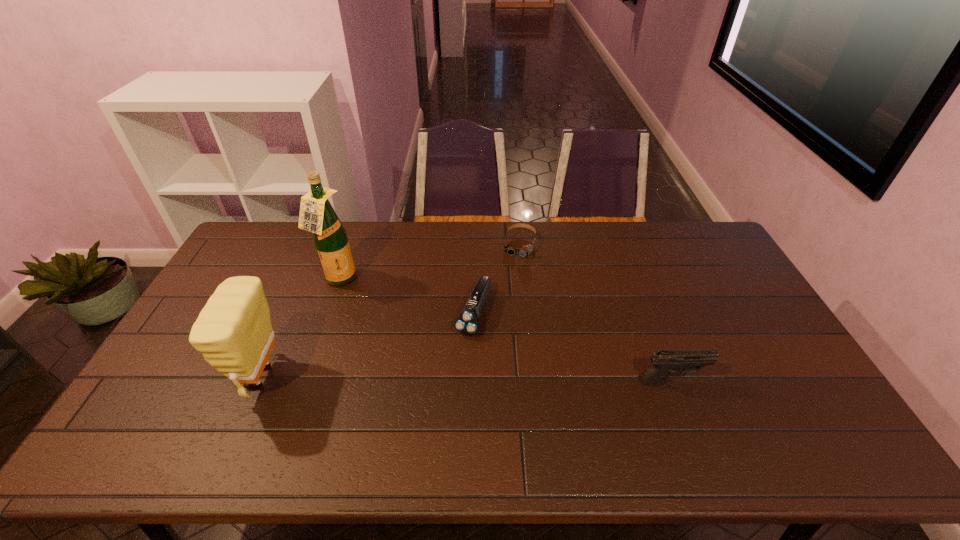
Find the location of a particular element. The height and width of the screenshot is (540, 960). vacant space situated 0.130m on the face of the sponge is located at coordinates [191, 377].

Image resolution: width=960 pixels, height=540 pixels. I want to click on free location located 0.280m at the barrel of the third shortest object, so click(x=806, y=381).

The height and width of the screenshot is (540, 960). What are the coordinates of `free space located 0.260m on the front-facing side of the liquor` in the screenshot? It's located at (399, 330).

Locate an element on the screen. The image size is (960, 540). vacant space located on the front-facing side of the liquor is located at coordinates (361, 300).

Identify the location of free location located on the front-facing side of the liquor. This screenshot has height=540, width=960. (365, 302).

You are a GUI agent. You are given a task and a screenshot of the screen. Output one action in this format:
    pyautogui.click(x=<x>, y=<y>)
    Task: Click on the free space located on the front-facing side of the second object from right to left
    The height and width of the screenshot is (540, 960).
    Given the screenshot: What is the action you would take?
    pyautogui.click(x=512, y=280)

What are the coordinates of `free space located 0.110m on the front-facing side of the second object from right to left` in the screenshot? It's located at (513, 278).

Identify the location of vacant area situated on the front-facing side of the second object from right to left. This screenshot has width=960, height=540. [507, 300].

Identify the location of blank space located on the head of the second shortest object. The image size is (960, 540). (451, 380).

Image resolution: width=960 pixels, height=540 pixels. Find the location of `vacant space situated 0.090m on the head of the second shortest object`. vacant space situated 0.090m on the head of the second shortest object is located at coordinates (458, 363).